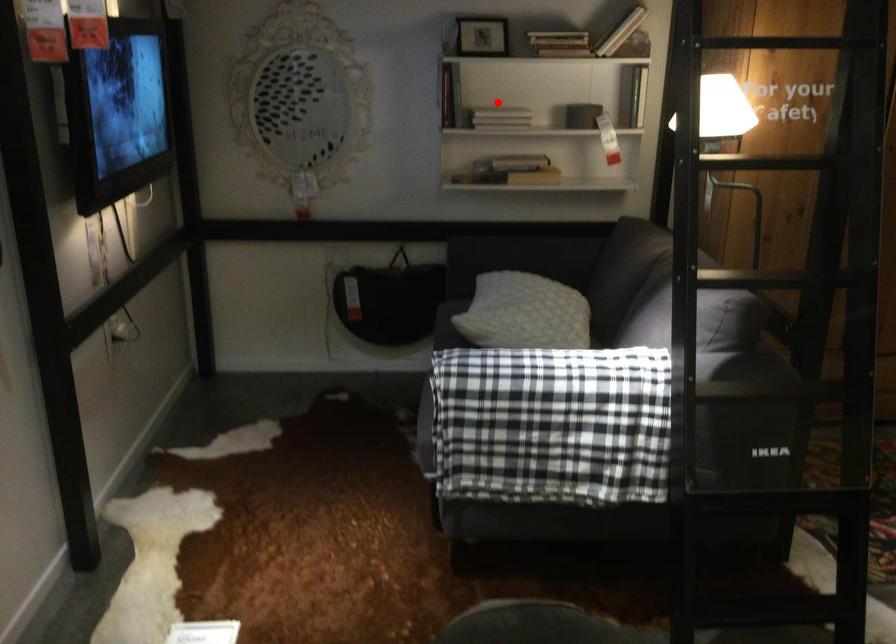
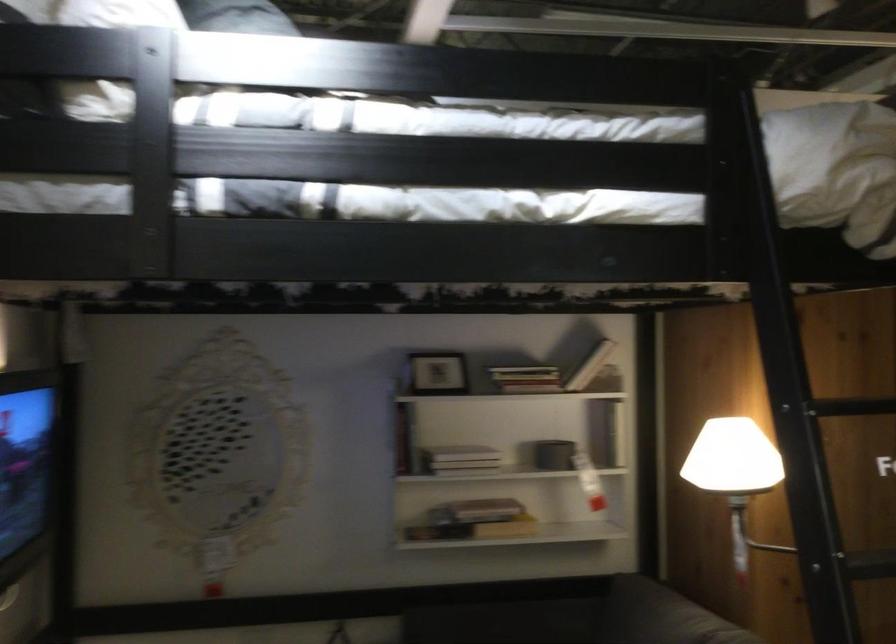
Question: I am providing you with two images of the same scene from different viewpoints. Given a red point in image1, look at the same physical point in image2. Is it:

Choices:
 (A) Closer to the viewpoint
 (B) Farther from the viewpoint

Answer: (A)